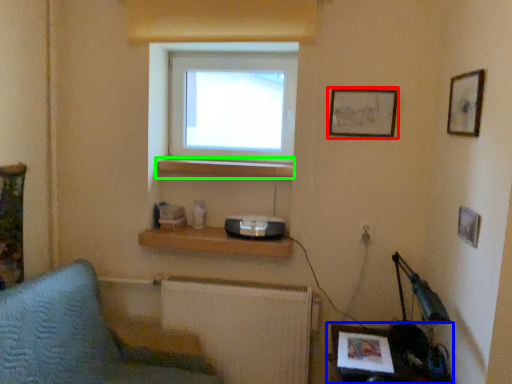
Question: Estimate the real-world distances between objects in this image. Which object is closer to picture frame (highlighted by a red box), table (highlighted by a blue box) or window sill (highlighted by a green box)?

Choices:
 (A) table
 (B) window sill

Answer: (B)